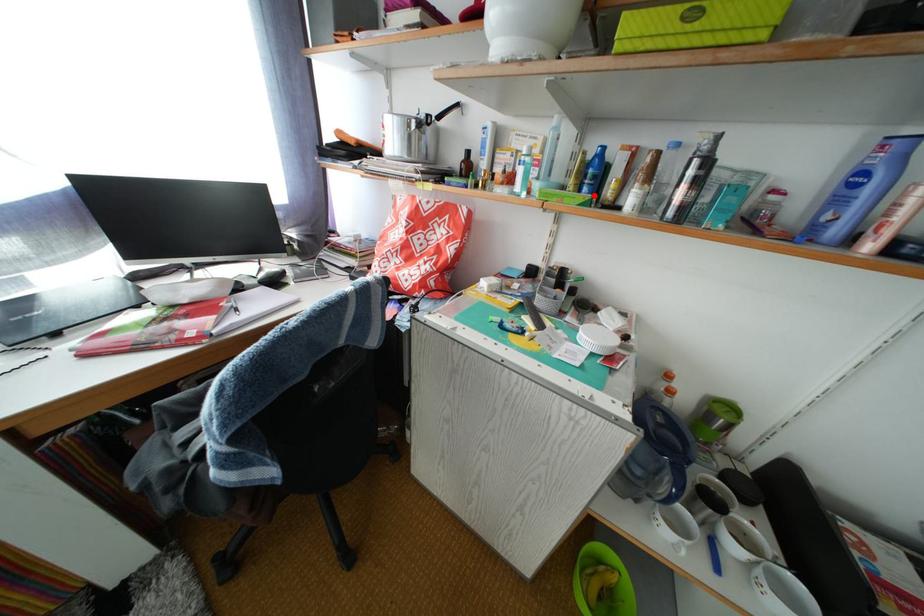
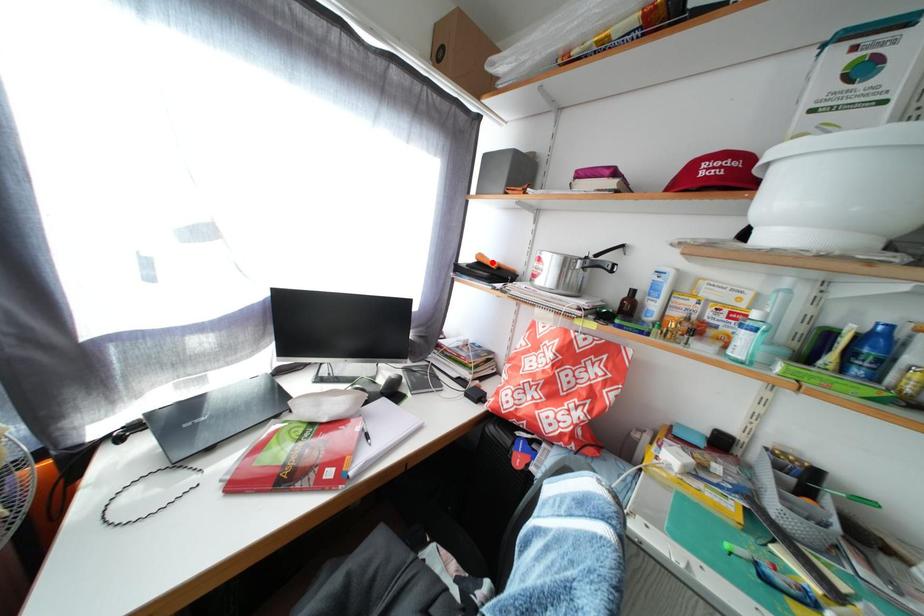
I am providing you with two images of the same scene from different viewpoints. A red point is marked on the first image and another point is marked on the second image. Is the red point in image1 aligned with the point shown in image2?

No